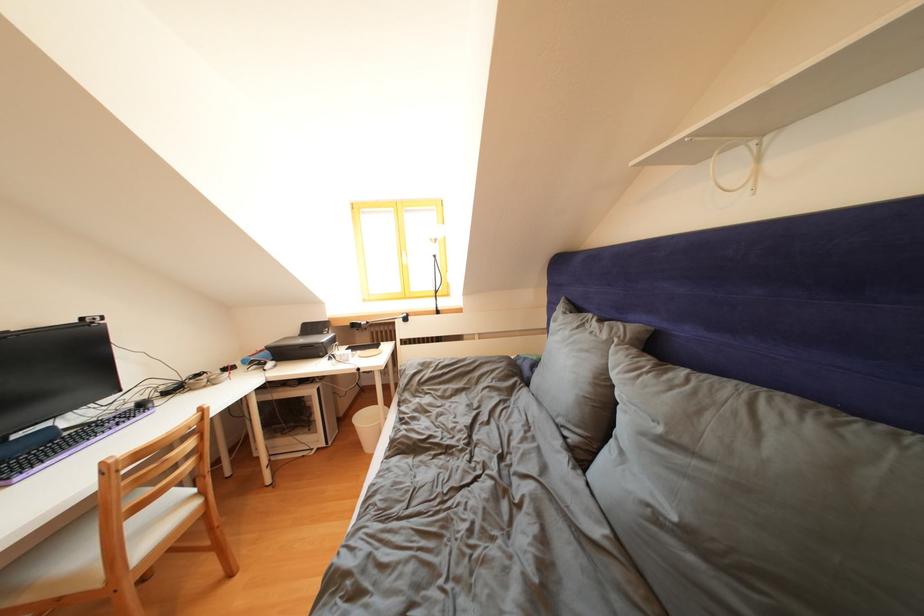
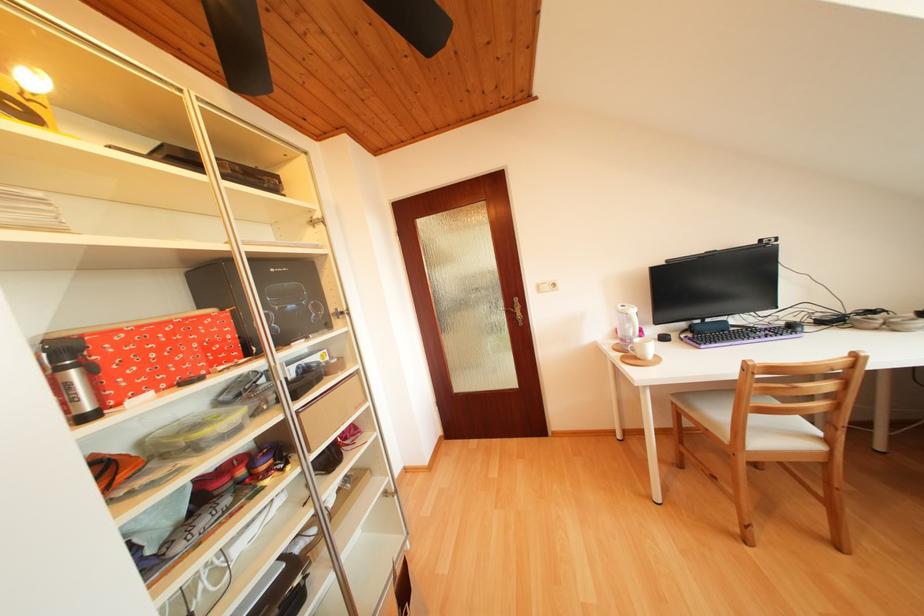
Locate, in the second image, the point that corresponds to pixel 239 580 in the first image.

(847, 553)